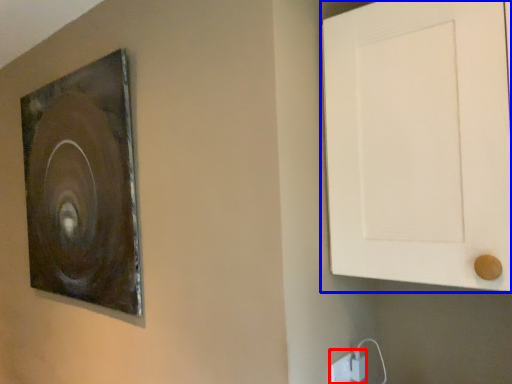
Question: Which of the following is the farthest to the observer, electric outlet (highlighted by a red box) or door (highlighted by a blue box)?

Choices:
 (A) electric outlet
 (B) door

Answer: (A)